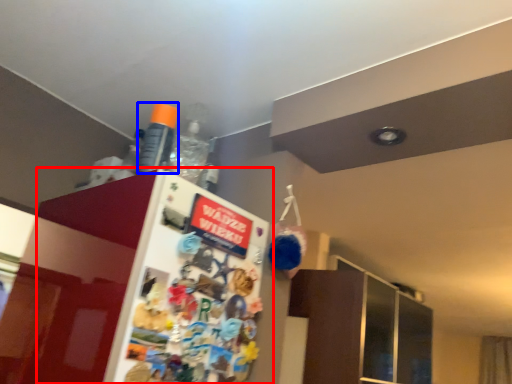
Question: Among these objects, which one is nearest to the camera, fridge (highlighted by a red box) or bottle (highlighted by a blue box)?

Choices:
 (A) fridge
 (B) bottle

Answer: (A)